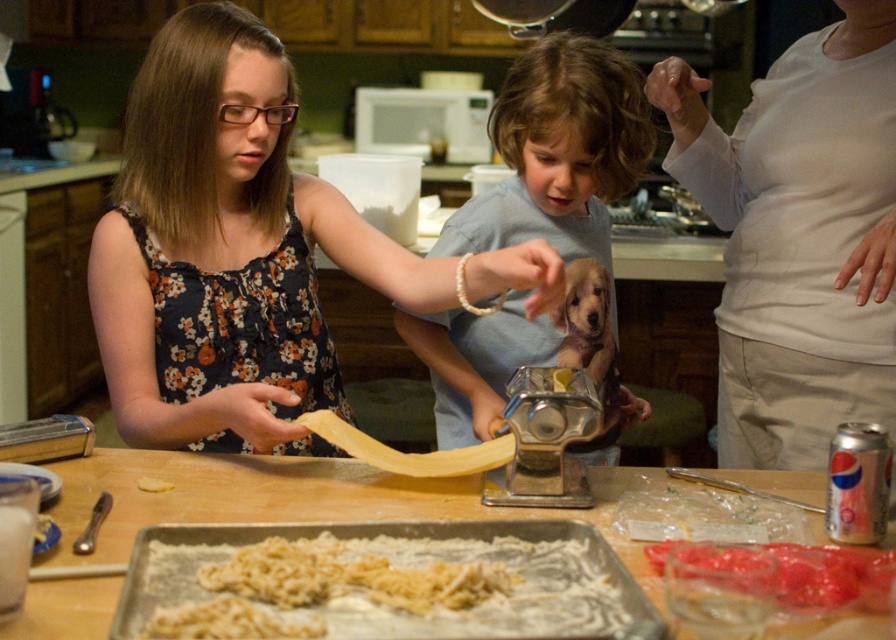
You are a photographer positioned in the kitchen and want to take a photo that includes both the white cotton shirt at upper right and the white crumbly pasta at center. Which object should you focus on first to ensure both are in sharp focus?

You should focus on the white cotton shirt at upper right first because it is closer to you than the white crumbly pasta at center. By focusing on the closer object, the farther one may still be in focus depending on the depth of field.

You are a chef in a busy kitchen and need to quickly identify which item is bigger between the light blue shirt at center and the yellow matte pasta at center. Which one should you choose?

The light blue shirt at center is larger in size than the yellow matte pasta at center, so you should choose the light blue shirt at center.